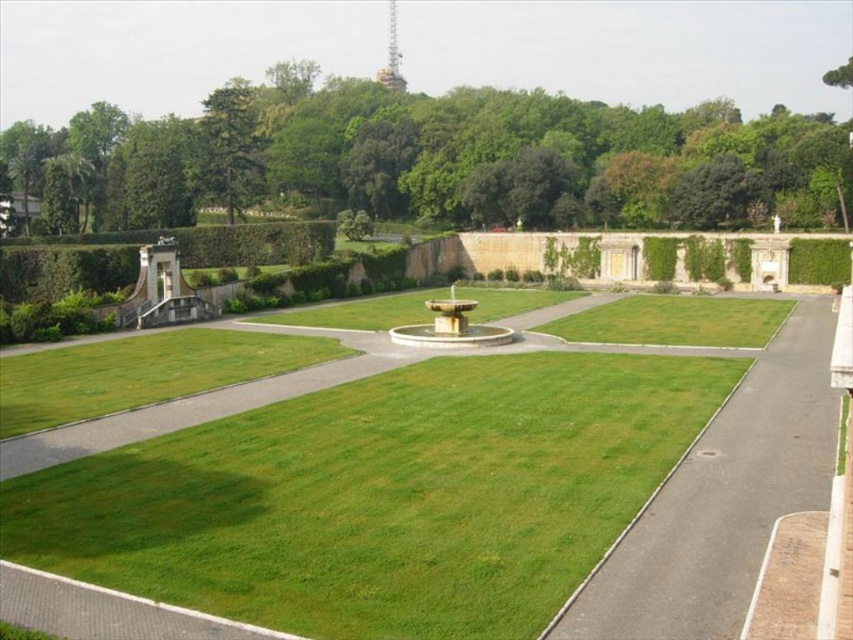
Which of these two, green leafy tree at upper center or green leafy tree at upper left, stands shorter?

green leafy tree at upper center

Can you confirm if green leafy tree at upper center is positioned above green leafy tree at upper left?

No, green leafy tree at upper center is not above green leafy tree at upper left.

The image size is (853, 640). Find the location of `green leafy tree at upper center`. green leafy tree at upper center is located at coordinates (471, 157).

From the picture: Between green leafy tree at upper left and white stone fountain at center, which one is positioned higher?

green leafy tree at upper left is above.

Can you confirm if green leafy tree at upper left is taller than white stone fountain at center?

Indeed, green leafy tree at upper left has a greater height compared to white stone fountain at center.

Does point (221, 134) come farther from viewer compared to point (438, 308)?

Yes, point (221, 134) is farther from viewer.

Identify the location of green leafy tree at upper left. Image resolution: width=853 pixels, height=640 pixels. (229, 147).

Between green leafy tree at upper center and white stone fountain at center, which one has more height?

green leafy tree at upper center is taller.

I want to click on green leafy tree at upper center, so click(471, 157).

Looking at this image, who is more forward, (477, 102) or (393, 326)?

Point (393, 326) is more forward.

Locate an element on the screen. This screenshot has width=853, height=640. green leafy tree at upper center is located at coordinates (471, 157).